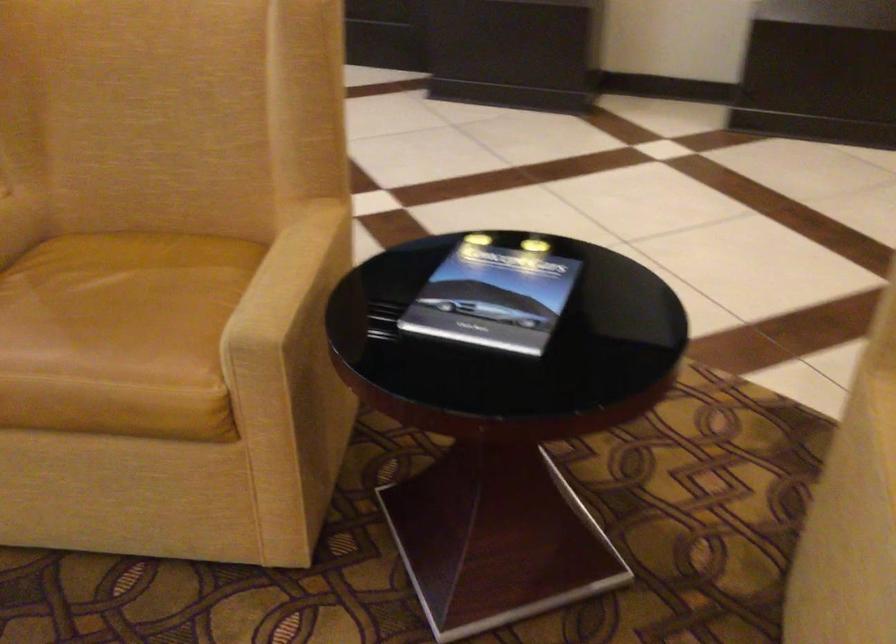
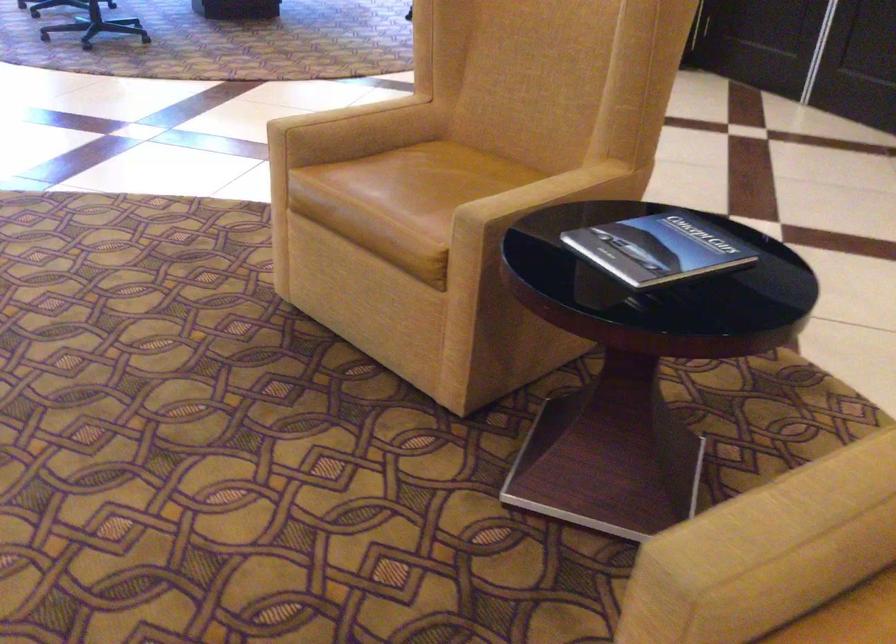
The point at (x=297, y=272) is marked in the first image. Where is the corresponding point in the second image?

(541, 193)